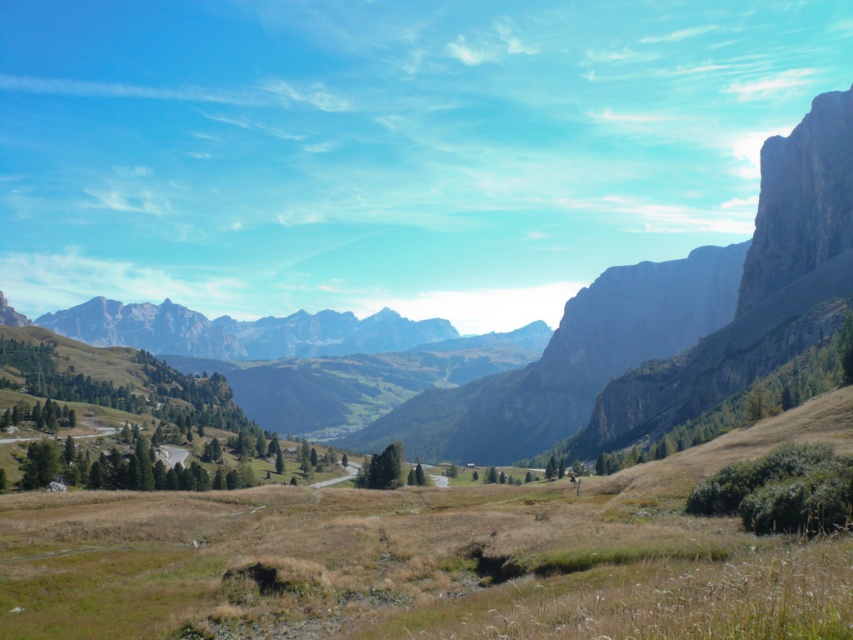
Is dry grass at center further to the viewer compared to rocky gray mountain range at center?

No, it is in front of rocky gray mountain range at center.

The image size is (853, 640). In order to click on dry grass at center in this screenshot , I will do `click(404, 566)`.

Does point (245, 605) come behind point (720, 337)?

No, it is in front of (720, 337).

At what (x,y) coordinates should I click in order to perform the action: click on dry grass at center. Please return your answer as a coordinate pair (x, y). Looking at the image, I should click on (404, 566).